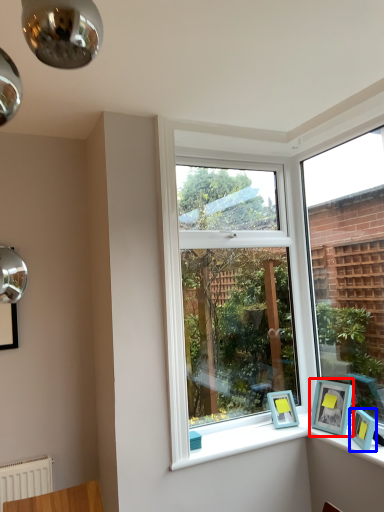
Question: Among these objects, which one is farthest to the camera, picture frame (highlighted by a red box) or picture frame (highlighted by a blue box)?

Choices:
 (A) picture frame
 (B) picture frame

Answer: (A)